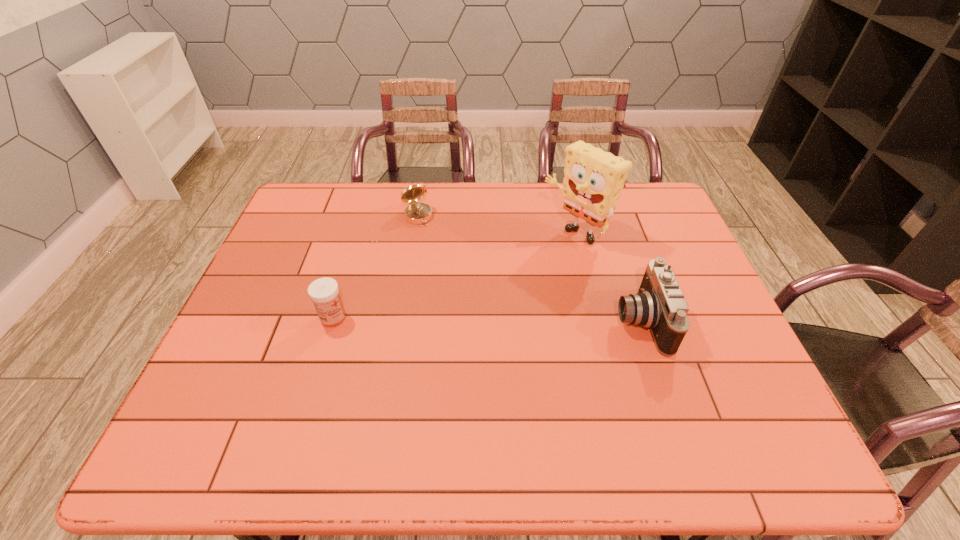
You are a GUI agent. You are given a task and a screenshot of the screen. Output one action in this format:
    pyautogui.click(x=<x>, y=<y>)
    Task: Click on the free spot between the third shortest object and the third object from right to left
    This screenshot has height=540, width=960.
    Given the screenshot: What is the action you would take?
    pyautogui.click(x=529, y=269)

At what (x,y) coordinates should I click in order to perform the action: click on empty location between the sponge and the third object from right to left. Please return your answer as a coordinate pair (x, y). Image resolution: width=960 pixels, height=540 pixels. Looking at the image, I should click on (496, 225).

What are the coordinates of `unoccupied position between the medicine and the sponge` in the screenshot? It's located at (454, 276).

Where is `empty location between the second object from left to right and the medicine`? empty location between the second object from left to right and the medicine is located at coordinates (375, 267).

You are a GUI agent. You are given a task and a screenshot of the screen. Output one action in this format:
    pyautogui.click(x=<x>, y=<y>)
    Task: Click on the object that is the second nearest to the camera
    This screenshot has width=960, height=540.
    Given the screenshot: What is the action you would take?
    pyautogui.click(x=415, y=213)

At what (x,y) coordinates should I click in order to perform the action: click on object that is the nearest to the camera. Please return your answer as a coordinate pair (x, y). The width and height of the screenshot is (960, 540). Looking at the image, I should click on (593, 179).

The width and height of the screenshot is (960, 540). What are the coordinates of `free point that satisfies the following two spatial constraints: 1. on the front side of the third object from right to left; 2. on the right side of the sponge` in the screenshot? It's located at (415, 234).

Find the location of `vacant area in the image that satisfies the following two spatial constraints: 1. on the back side of the medicine; 2. on the right side of the sponge`. vacant area in the image that satisfies the following two spatial constraints: 1. on the back side of the medicine; 2. on the right side of the sponge is located at coordinates (359, 234).